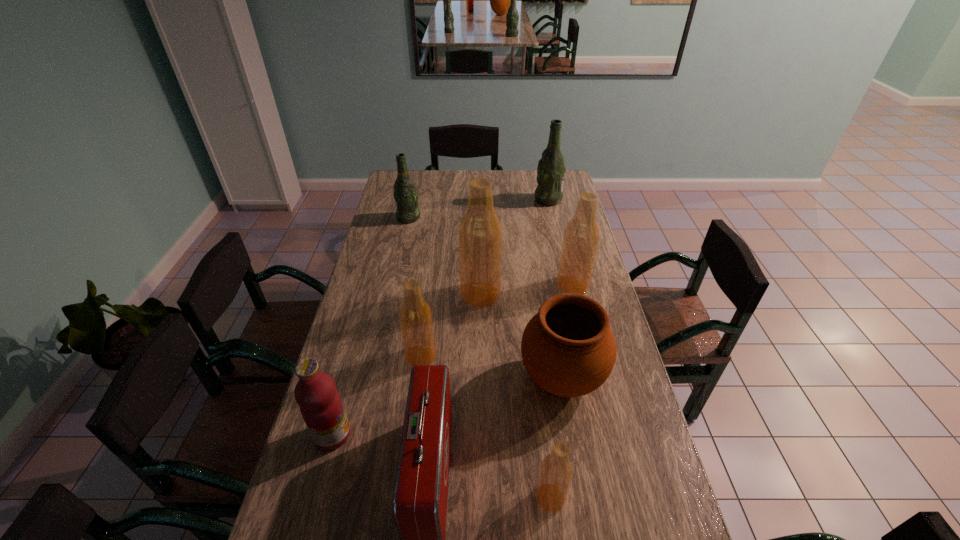
Find the location of a particular element. free space at the right edge of the desktop is located at coordinates (600, 421).

Locate an element on the screen. The image size is (960, 540). empty space between the fifth beer bottle from right to left and the tallest object is located at coordinates (450, 326).

The height and width of the screenshot is (540, 960). Find the location of `free point between the second farthest beer bottle and the fifth object from right to left`. free point between the second farthest beer bottle and the fifth object from right to left is located at coordinates (444, 256).

The width and height of the screenshot is (960, 540). I want to click on vacant region between the nearest tan beer bottle and the third tan beer bottle from right to left, so click(516, 396).

The width and height of the screenshot is (960, 540). Find the location of `vacant area that lies between the third biggest tan beer bottle and the rightmost tan beer bottle`. vacant area that lies between the third biggest tan beer bottle and the rightmost tan beer bottle is located at coordinates (497, 321).

I want to click on empty space that is in between the rightmost tan beer bottle and the farther green beer bottle, so click(561, 242).

Image resolution: width=960 pixels, height=540 pixels. Identify the location of unoccupied area between the smaller green beer bottle and the shortest beer bottle. (x=480, y=357).

I want to click on free space that is in between the second smallest tan beer bottle and the pink fruit juice, so click(377, 395).

Point out which object is positioned as the seventh nearest to the second beer bottle from left to right. Please provide its 2D coordinates. Your answer should be formatted as a tuple, i.e. [(x, y)], where the tuple contains the x and y coordinates of a point satisfying the conditions above.

[(405, 194)]

You are a GUI agent. You are given a task and a screenshot of the screen. Output one action in this format:
    pyautogui.click(x=<x>, y=<y>)
    Task: Click on the object that stands as the fourth closest to the fruit juice
    
    Given the screenshot: What is the action you would take?
    pyautogui.click(x=556, y=471)